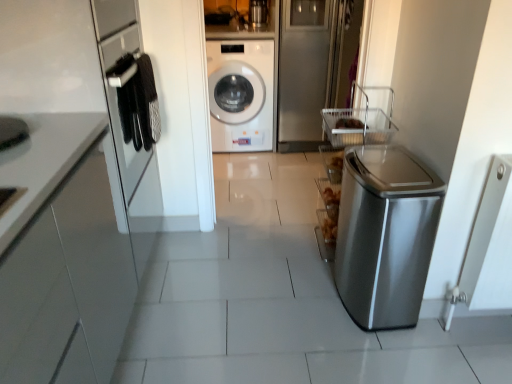
This screenshot has width=512, height=384. I want to click on free point to the left of satin silver trash can at right, so click(x=296, y=295).